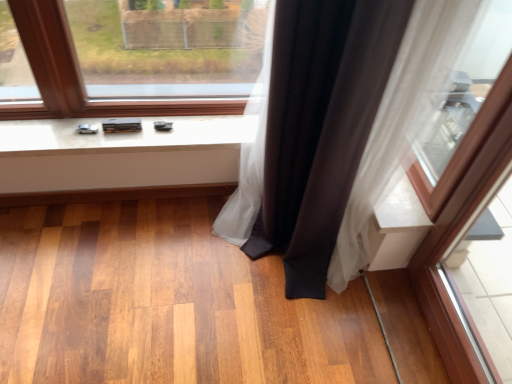
You are a GUI agent. You are given a task and a screenshot of the screen. Output one action in this format:
    pyautogui.click(x=<x>, y=<y>)
    Task: Click on the free spot above white matte window sill at center (from a real-world perspective)
    The height and width of the screenshot is (384, 512).
    Given the screenshot: What is the action you would take?
    pyautogui.click(x=150, y=122)